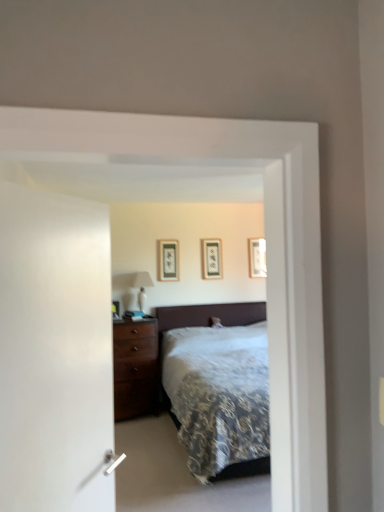
Question: Is wooden picture frame at upper right, which appears as the 1th picture frame when viewed from the back, completely or partially outside of white glossy table lamp at left?

Choices:
 (A) yes
 (B) no

Answer: (A)

Question: Considering the relative sizes of wooden picture frame at upper right, marked as the first picture frame in a right-to-left arrangement, and white glossy table lamp at left in the image provided, is wooden picture frame at upper right, marked as the first picture frame in a right-to-left arrangement, bigger than white glossy table lamp at left?

Choices:
 (A) no
 (B) yes

Answer: (A)

Question: Is wooden picture frame at upper right, the 3th picture frame from the left, looking in the opposite direction of white glossy table lamp at left?

Choices:
 (A) no
 (B) yes

Answer: (A)

Question: Considering the relative sizes of wooden picture frame at upper right, which appears as the 1th picture frame when viewed from the back, and white glossy table lamp at left in the image provided, is wooden picture frame at upper right, which appears as the 1th picture frame when viewed from the back, thinner than white glossy table lamp at left?

Choices:
 (A) yes
 (B) no

Answer: (A)

Question: Considering the relative positions of wooden picture frame at upper right, marked as the first picture frame in a right-to-left arrangement, and white glossy table lamp at left in the image provided, is wooden picture frame at upper right, marked as the first picture frame in a right-to-left arrangement, to the left of white glossy table lamp at left from the viewer's perspective?

Choices:
 (A) yes
 (B) no

Answer: (B)

Question: In terms of height, does matte black picture frame at center, acting as the 3th picture frame starting from the right, look taller or shorter compared to white glossy table lamp at left?

Choices:
 (A) short
 (B) tall

Answer: (A)

Question: Looking at the image, does matte black picture frame at center, which is the third picture frame in back-to-front order, seem bigger or smaller compared to white glossy table lamp at left?

Choices:
 (A) small
 (B) big

Answer: (A)

Question: In the image, is matte black picture frame at center, acting as the 3th picture frame starting from the right, positioned in front of or behind white glossy table lamp at left?

Choices:
 (A) behind
 (B) front

Answer: (A)

Question: Is point (165, 258) positioned closer to the camera than point (140, 290)?

Choices:
 (A) closer
 (B) farther

Answer: (B)

Question: Is white glossy table lamp at left in front of or behind matte black picture frame at center, which is the third picture frame in back-to-front order, in the image?

Choices:
 (A) behind
 (B) front

Answer: (B)

Question: From the image's perspective, relative to matte black picture frame at center, which is counted as the 1th picture frame, starting from the left, is white glossy table lamp at left above or below?

Choices:
 (A) below
 (B) above

Answer: (A)

Question: Would you say white glossy table lamp at left is to the left or to the right of matte black picture frame at center, which is the third picture frame in back-to-front order, in the picture?

Choices:
 (A) left
 (B) right

Answer: (A)

Question: In terms of height, does white glossy table lamp at left look taller or shorter compared to matte black picture frame at center, which is the third picture frame in back-to-front order?

Choices:
 (A) tall
 (B) short

Answer: (A)

Question: Relative to wooden picture frame at upper right, marked as the first picture frame in a right-to-left arrangement, is matte black picture frame at center, the 2th picture frame from the back, in front or behind?

Choices:
 (A) behind
 (B) front

Answer: (B)

Question: Is matte black picture frame at center, the second picture frame positioned from the left, taller or shorter than wooden picture frame at upper right, the 3th picture frame from the left?

Choices:
 (A) tall
 (B) short

Answer: (A)